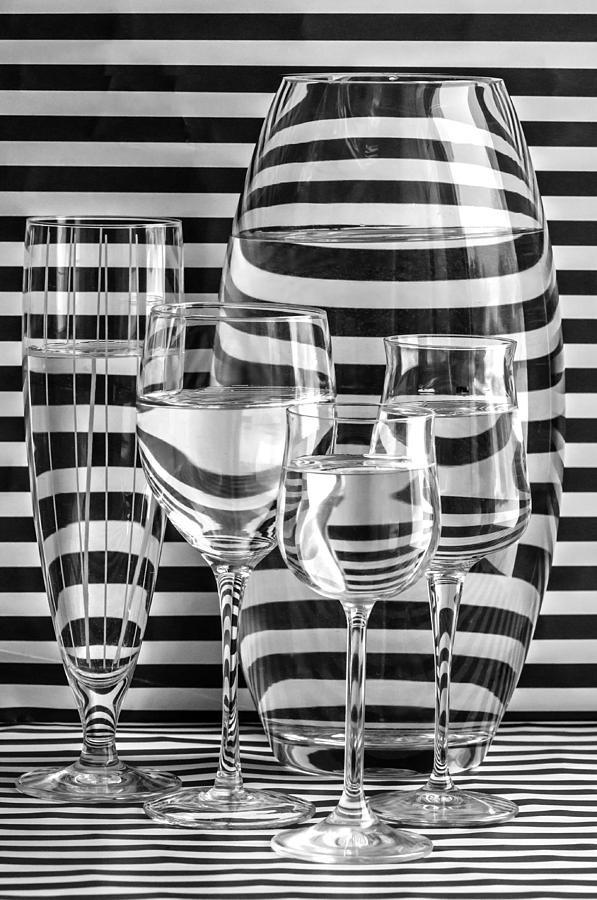
The height and width of the screenshot is (900, 597). In order to click on wine glass base in this screenshot , I will do `click(87, 786)`, `click(235, 808)`, `click(347, 852)`, `click(450, 814)`, `click(400, 769)`.